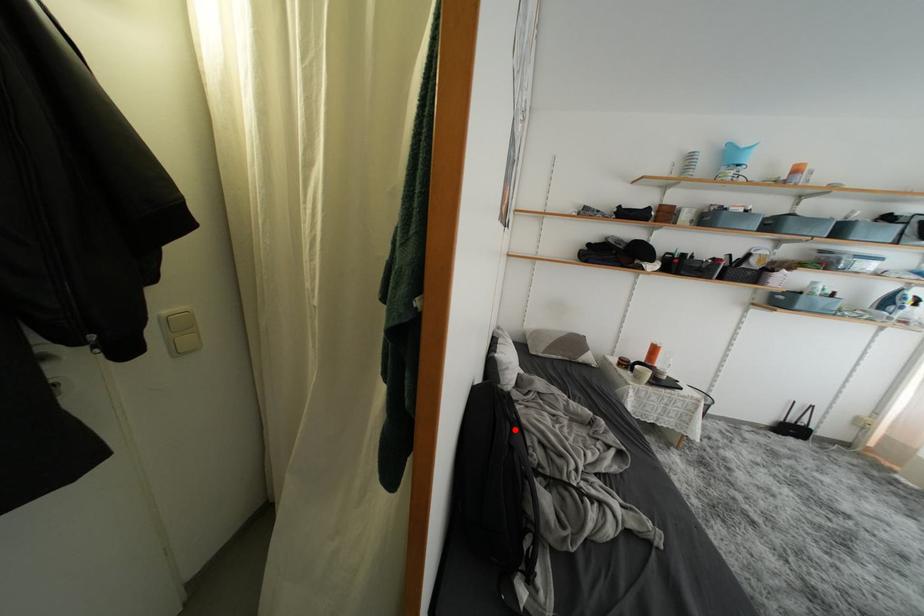
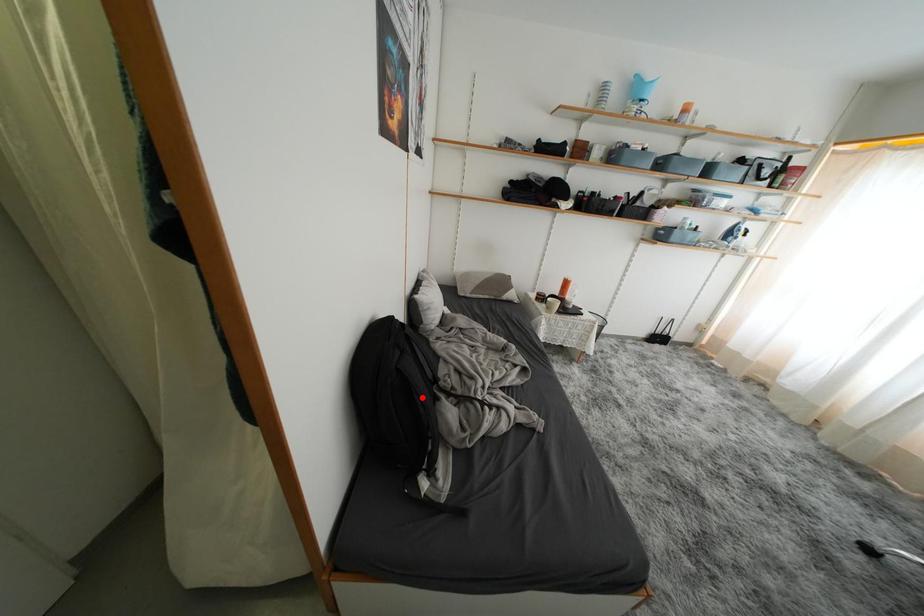
I am providing you with two images of the same scene from different viewpoints. A red point is marked on the first image and another point is marked on the second image. Are the points marked in image1 and image2 representing the same 3D position?

No